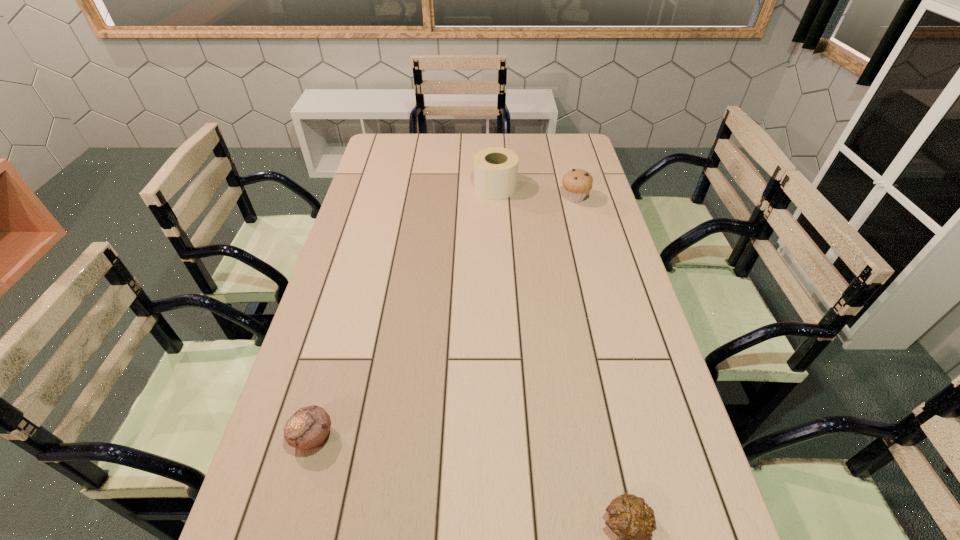
Find the location of `the second object from left to right`. the second object from left to right is located at coordinates (495, 169).

Locate an element on the screen. This screenshot has height=540, width=960. the second tallest object is located at coordinates (577, 183).

Identify the location of the farthest muffin. This screenshot has height=540, width=960. (577, 183).

The width and height of the screenshot is (960, 540). In order to click on the third tallest object in this screenshot , I will do `click(307, 429)`.

Identify the location of the second shortest muffin. Image resolution: width=960 pixels, height=540 pixels. (307, 429).

Locate an element on the screen. The image size is (960, 540). vacant space situated 0.060m on the right of the toilet tissue is located at coordinates (532, 187).

Where is `vacant space located 0.070m on the back of the third shortest object`? vacant space located 0.070m on the back of the third shortest object is located at coordinates (570, 180).

Where is `vacant space located on the right of the leftmost muffin`? The width and height of the screenshot is (960, 540). vacant space located on the right of the leftmost muffin is located at coordinates (405, 437).

Identify the location of object present at the left edge. The width and height of the screenshot is (960, 540). (307, 429).

Find the location of `object that is at the right edge`. object that is at the right edge is located at coordinates (577, 183).